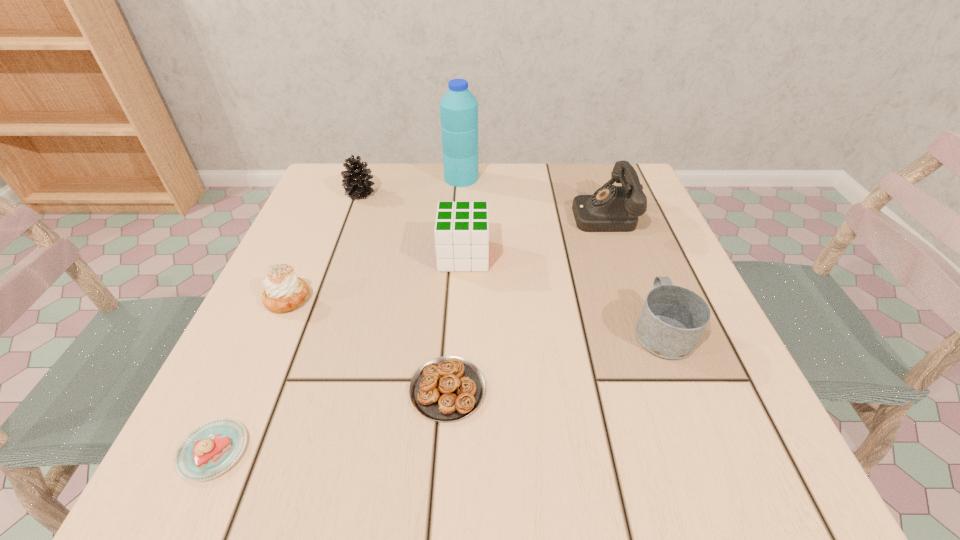
Find the location of a particular element. This screenshot has width=960, height=540. water bottle that is positioned at the far edge is located at coordinates (458, 108).

You are a GUI agent. You are given a task and a screenshot of the screen. Output one action in this format:
    pyautogui.click(x=<x>, y=<y>)
    Task: Click on the telephone present at the far edge
    This screenshot has width=960, height=540.
    Given the screenshot: What is the action you would take?
    coord(611,208)

You are a GUI agent. You are given a task and a screenshot of the screen. Output one action in this format:
    pyautogui.click(x=<x>, y=<y>)
    Task: Click on the pinecone present at the far edge
    
    Given the screenshot: What is the action you would take?
    pyautogui.click(x=356, y=182)

Image resolution: width=960 pixels, height=540 pixels. I want to click on pinecone that is at the left edge, so click(x=356, y=182).

Identify the location of telephone located at the right edge. This screenshot has height=540, width=960. (611, 208).

The image size is (960, 540). Find the location of `mug present at the right edge`. mug present at the right edge is located at coordinates (673, 319).

This screenshot has height=540, width=960. I want to click on object present at the far left corner, so click(356, 182).

The height and width of the screenshot is (540, 960). Identify the location of object that is at the near left corner. (212, 448).

The width and height of the screenshot is (960, 540). Identify the location of object that is at the far right corner. (611, 208).

Find the location of a particular element. The image size is (960, 540). vacant space at the far edge of the desktop is located at coordinates (566, 177).